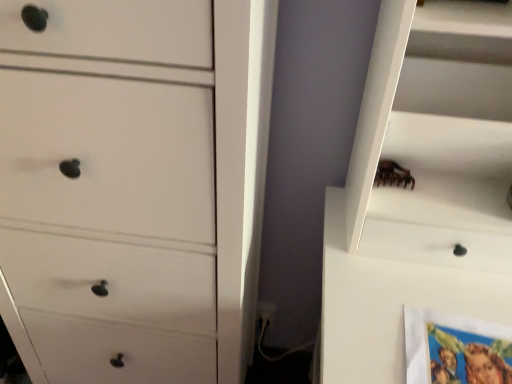
Locate an element on the screen. The image size is (512, 384). white matte chest of drawers at left is located at coordinates (133, 187).

Measure the distance between point (70,357) and camera.

They are 37.68 inches apart.

The height and width of the screenshot is (384, 512). What do you see at coordinates (133, 187) in the screenshot? I see `white matte chest of drawers at left` at bounding box center [133, 187].

Identify the location of white matte chest of drawers at left. The image size is (512, 384). (133, 187).